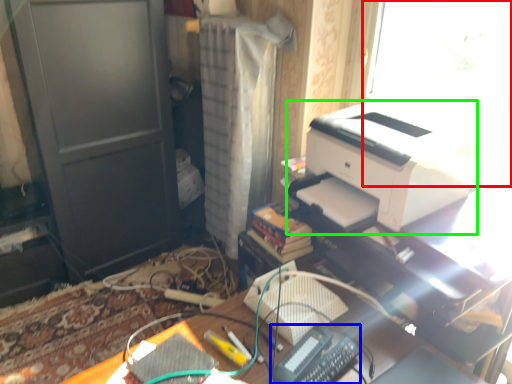
Question: Which object is the closest to the window screen (highlighted by a red box)? Choose among these: equipment (highlighted by a blue box) or printer (highlighted by a green box).

Choices:
 (A) equipment
 (B) printer

Answer: (B)